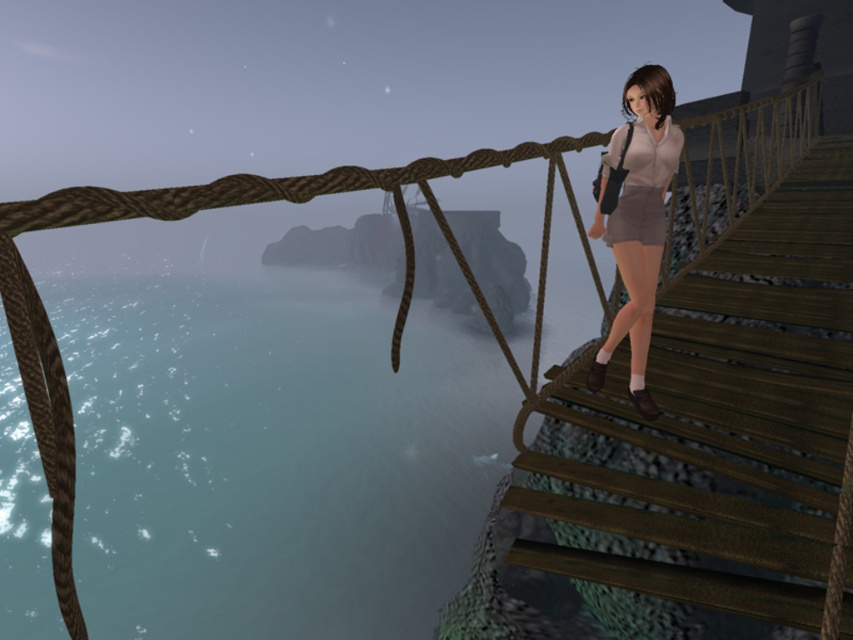
You are a character in a video game who needs to cross the wooden bridge. You see the translucent blue water at lower left and the wooden stairs at right. Which path should you take if you want to avoid the wider area?

You should take the wooden stairs at right because the translucent blue water at lower left is wider than the wooden stairs at right, so the stairs are narrower and safer to avoid the wider area.

You are a character in the game who needs to jump from the bridge to the ground below. The translucent blue water at lower left and the matte gray shorts at center are both visible from your position. Which object is higher from your current viewpoint?

The translucent blue water at lower left has a greater height compared to the matte gray shorts at center, so the translucent blue water at lower left is higher from your current viewpoint.

You are a character in the game who wants to cross the wooden bridge. You need to decide whether to go left towards the translucent blue water at lower left or right towards the wooden stairs at right. Which direction leads to the bridge exit?

The wooden stairs at right lead to the bridge exit because the translucent blue water at lower left is positioned on the left side of the wooden stairs at right, indicating the stairs are closer to the exit.